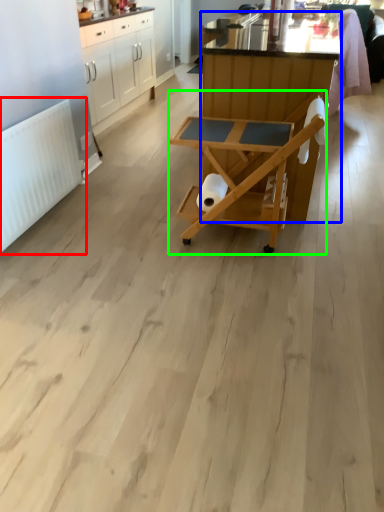
Question: Based on their relative distances, which object is nearer to radiator (highlighted by a red box)? Choose from table (highlighted by a blue box) and table (highlighted by a green box).

Choices:
 (A) table
 (B) table

Answer: (B)